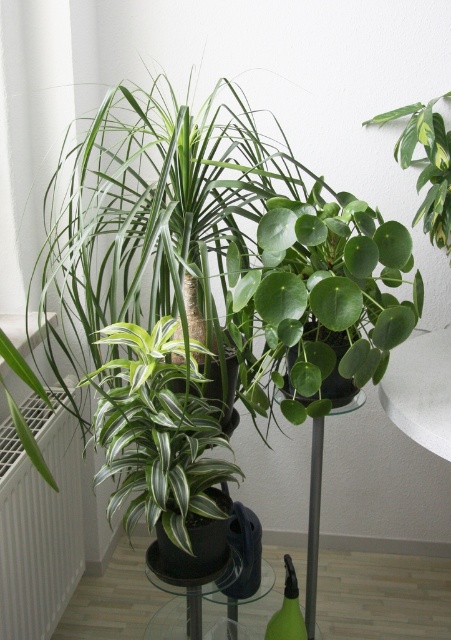
Question: Which point is closer to the camera taking this photo?

Choices:
 (A) (19, 460)
 (B) (437, 100)

Answer: (A)

Question: Which of the following is the closest to the observer?

Choices:
 (A) green translucent bottle at lower center
 (B) green glossy leaf at upper right
 (C) transparent glass table at center
 (D) green matte leafy plant at center

Answer: (D)

Question: Does transparent glass table at center lie in front of green translucent bottle at lower center?

Choices:
 (A) yes
 (B) no

Answer: (A)

Question: Does transparent glass table at lower center have a lesser width compared to transparent glass table at center?

Choices:
 (A) yes
 (B) no

Answer: (B)

Question: Among these points, which one is nearest to the camera?

Choices:
 (A) (174, 609)
 (B) (415, 109)

Answer: (B)

Question: Does white metallic radiator at lower left appear under transparent glass table at lower center?

Choices:
 (A) yes
 (B) no

Answer: (B)